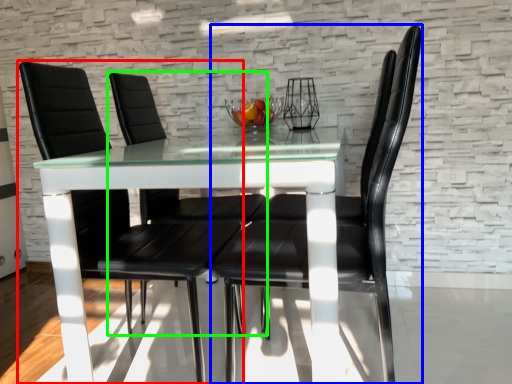
Question: Based on their relative distances, which object is farther from chair (highlighted by a red box)? Choose from chair (highlighted by a blue box) and chair (highlighted by a green box).

Choices:
 (A) chair
 (B) chair

Answer: (A)